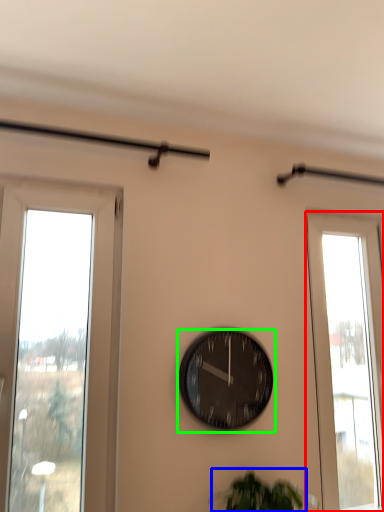
Question: Which object is positioned closest to window (highlighted by a red box)? Select from plant (highlighted by a blue box) and wall clock (highlighted by a green box).

Choices:
 (A) plant
 (B) wall clock

Answer: (B)